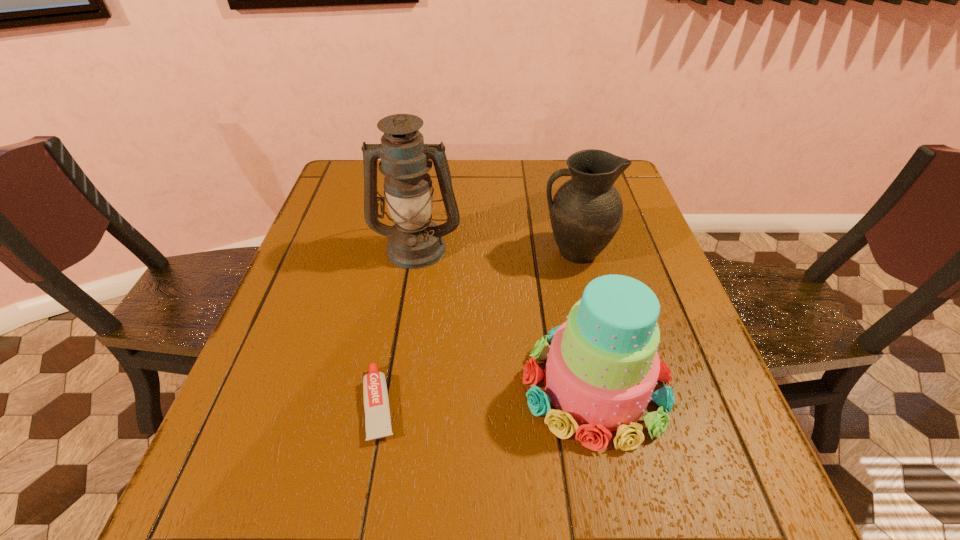
Locate an element on the screen. The image size is (960, 540). the tallest object is located at coordinates (414, 242).

The image size is (960, 540). Identify the location of pitcher. (586, 211).

This screenshot has width=960, height=540. What are the coordinates of `cake` in the screenshot? It's located at (602, 366).

Where is `the shortest object`? Image resolution: width=960 pixels, height=540 pixels. the shortest object is located at coordinates (376, 403).

This screenshot has width=960, height=540. I want to click on vacant region located on the front of the oil lamp, so coord(391,411).

Locate an element on the screen. Image resolution: width=960 pixels, height=540 pixels. vacant space located on the side of the pitcher with the handle is located at coordinates (382, 252).

Locate an element on the screen. The height and width of the screenshot is (540, 960). free region located 0.320m on the side of the pitcher with the handle is located at coordinates (410, 252).

Where is `vacant space located on the side of the pitcher with the handle`? The height and width of the screenshot is (540, 960). vacant space located on the side of the pitcher with the handle is located at coordinates (377, 252).

This screenshot has width=960, height=540. Find the location of `vacant region located 0.200m on the back of the cake`. vacant region located 0.200m on the back of the cake is located at coordinates (569, 265).

Identify the location of free location located on the left of the shortest object. This screenshot has height=540, width=960. (322, 404).